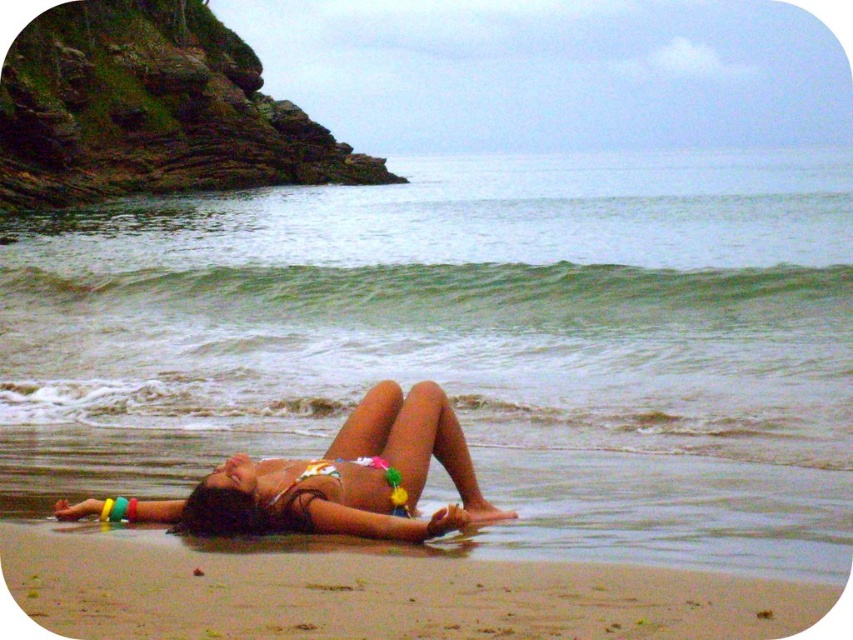
You are standing on the beach and want to take a photo of the point at coordinates (41, 525). Your camera has a focal length of 50mm and you are currently 10 meters away from the point. Should you move closer or farther away to ensure the point fills the frame properly?

The point at coordinates (41, 525) is 8.11 meters away from the camera. Since you are currently 10 meters away, you need to move closer to 8.11 meters to properly frame the point in your photo.